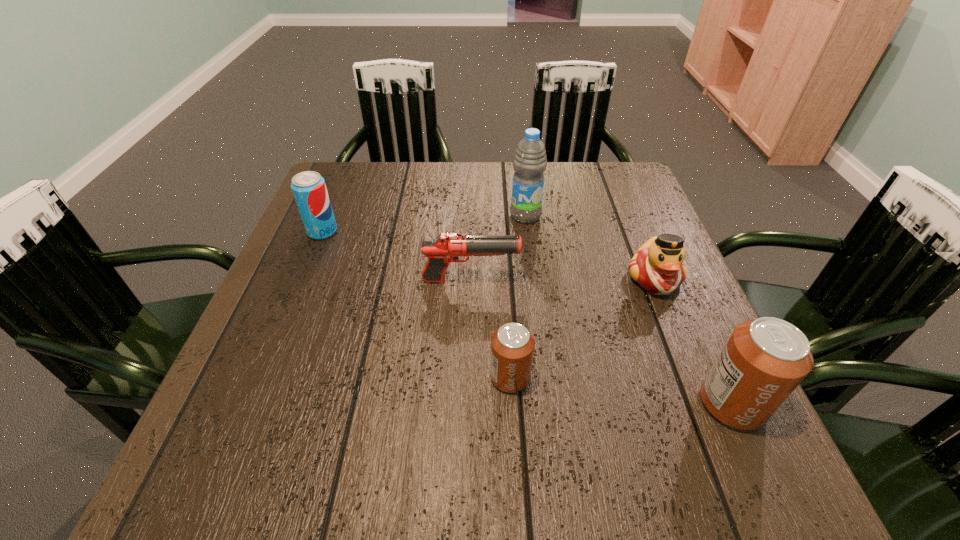
Locate an element on the screen. The width and height of the screenshot is (960, 540). free point that keeps the cans evenly spaced on the left is located at coordinates (308, 353).